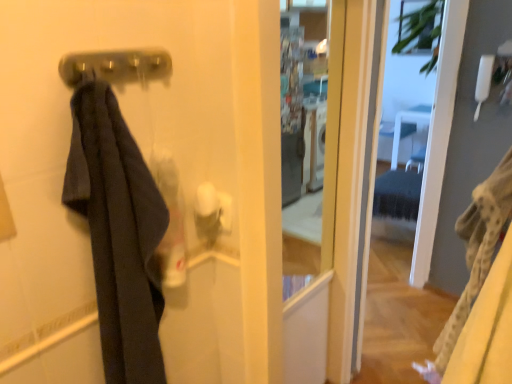
Question: Is transparent glass screen door at center closer to the viewer compared to metallic silver door handle at upper center?

Choices:
 (A) yes
 (B) no

Answer: (B)

Question: Is transparent glass screen door at center oriented towards metallic silver door handle at upper center?

Choices:
 (A) yes
 (B) no

Answer: (B)

Question: From a real-world perspective, is transparent glass screen door at center below metallic silver door handle at upper center?

Choices:
 (A) no
 (B) yes

Answer: (B)

Question: Can we say transparent glass screen door at center lies outside metallic silver door handle at upper center?

Choices:
 (A) no
 (B) yes

Answer: (B)

Question: Is transparent glass screen door at center at the left side of metallic silver door handle at upper center?

Choices:
 (A) yes
 (B) no

Answer: (B)

Question: Considering the positions of transparent glass screen door at center and metallic silver door handle at upper center in the image, is transparent glass screen door at center taller or shorter than metallic silver door handle at upper center?

Choices:
 (A) tall
 (B) short

Answer: (A)

Question: Is point (379, 208) positioned closer to the camera than point (96, 67)?

Choices:
 (A) farther
 (B) closer

Answer: (A)

Question: From the image's perspective, is transparent glass screen door at center located above or below metallic silver door handle at upper center?

Choices:
 (A) below
 (B) above

Answer: (A)

Question: From a real-world perspective, is transparent glass screen door at center physically located above or below metallic silver door handle at upper center?

Choices:
 (A) above
 (B) below

Answer: (B)

Question: From a real-world perspective, is transparent glass screen door at center above or below dark fabric towel at left?

Choices:
 (A) below
 (B) above

Answer: (A)

Question: From the image's perspective, is transparent glass screen door at center located above or below dark fabric towel at left?

Choices:
 (A) above
 (B) below

Answer: (A)

Question: Which is correct: transparent glass screen door at center is inside dark fabric towel at left, or outside of it?

Choices:
 (A) inside
 (B) outside

Answer: (B)

Question: Considering their positions, is transparent glass screen door at center located in front of or behind dark fabric towel at left?

Choices:
 (A) behind
 (B) front

Answer: (A)

Question: From the image's perspective, is dark fabric towel at left above or below transparent glass screen door at center?

Choices:
 (A) below
 (B) above

Answer: (A)

Question: Is dark fabric towel at left spatially inside transparent glass screen door at center, or outside of it?

Choices:
 (A) outside
 (B) inside

Answer: (A)